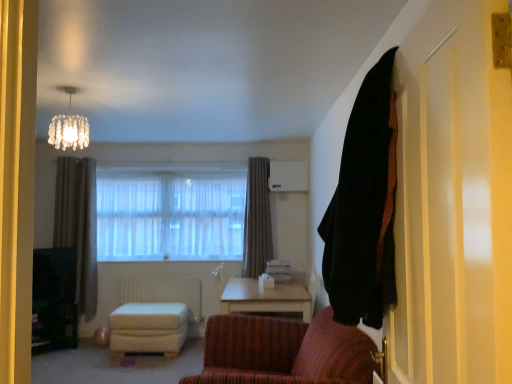
The height and width of the screenshot is (384, 512). In order to click on light wood table at center in this screenshot , I will do `click(268, 297)`.

The height and width of the screenshot is (384, 512). Describe the element at coordinates (69, 126) in the screenshot. I see `crystal glass chandelier at upper center` at that location.

How much space does black fabric curtain at upper right, the third curtain positioned from the back, occupy vertically?

black fabric curtain at upper right, the third curtain positioned from the back, is 38.89 inches tall.

This screenshot has width=512, height=384. What do you see at coordinates (257, 219) in the screenshot?
I see `brown fabric curtain at center, marked as the second curtain in a left-to-right arrangement` at bounding box center [257, 219].

I want to click on dark gray textured curtain at left, the third curtain when ordered from right to left, so (x=78, y=225).

What is the approximate width of dark gray textured curtain at left, marked as the second curtain in a back-to-front arrangement?

20.57 centimeters.

Find the location of a particular element. Image resolution: width=512 pixels, height=384 pixels. light wood table at center is located at coordinates (268, 297).

Is translucent fabric window at center far away from brown fabric curtain at center, acting as the 2th curtain starting from the right?

No, translucent fabric window at center is in close proximity to brown fabric curtain at center, acting as the 2th curtain starting from the right.

Looking at this image, considering the relative sizes of translucent fabric window at center and brown fabric curtain at center, marked as the second curtain in a left-to-right arrangement, in the image provided, is translucent fabric window at center smaller than brown fabric curtain at center, marked as the second curtain in a left-to-right arrangement,?

No.

Considering the sizes of translucent fabric window at center and brown fabric curtain at center, the 1th curtain viewed from the back, in the image, is translucent fabric window at center wider or thinner than brown fabric curtain at center, the 1th curtain viewed from the back,?

In the image, translucent fabric window at center appears to be more narrow than brown fabric curtain at center, the 1th curtain viewed from the back.

Can you confirm if brown fabric curtain at center, the 1th curtain viewed from the back, is smaller than crystal glass chandelier at upper center?

No.

From the image's perspective, which is below, brown fabric curtain at center, acting as the 2th curtain starting from the right, or crystal glass chandelier at upper center?

brown fabric curtain at center, acting as the 2th curtain starting from the right, from the image's perspective.

From the picture: Is brown fabric curtain at center, the 1th curtain viewed from the back, situated inside crystal glass chandelier at upper center or outside?

brown fabric curtain at center, the 1th curtain viewed from the back, lies outside crystal glass chandelier at upper center.

Consider the image. How different are the orientations of black fabric curtain at upper right, which ranks as the 3th curtain in left-to-right order, and dark gray textured curtain at left, marked as the second curtain in a back-to-front arrangement, in degrees?

87.5 degrees.

Which is closer to the camera, (373, 165) or (88, 174)?

Point (373, 165) is positioned closer to the camera compared to point (88, 174).

Visually, is black fabric curtain at upper right, the first curtain positioned from the right, positioned to the left or to the right of dark gray textured curtain at left, which is the first curtain from left to right?

Based on their positions, black fabric curtain at upper right, the first curtain positioned from the right, is located to the right of dark gray textured curtain at left, which is the first curtain from left to right.

Is black fabric curtain at upper right, the 1th curtain when ordered from front to back, looking in the opposite direction of dark gray textured curtain at left, the 2th curtain positioned from the front?

No, black fabric curtain at upper right, the 1th curtain when ordered from front to back, is not facing the opposite direction of dark gray textured curtain at left, the 2th curtain positioned from the front.

In the image, is dark gray textured curtain at left, the 2th curtain positioned from the front, positioned in front of or behind crystal glass chandelier at upper center?

dark gray textured curtain at left, the 2th curtain positioned from the front, is behind crystal glass chandelier at upper center.

Can you confirm if dark gray textured curtain at left, marked as the second curtain in a back-to-front arrangement, is wider than crystal glass chandelier at upper center?

No, dark gray textured curtain at left, marked as the second curtain in a back-to-front arrangement, is not wider than crystal glass chandelier at upper center.

Does dark gray textured curtain at left, marked as the second curtain in a back-to-front arrangement, appear on the right side of crystal glass chandelier at upper center?

No.

Is dark gray textured curtain at left, the 2th curtain positioned from the front, facing away from crystal glass chandelier at upper center?

No.

Consider the image. Considering the relative sizes of white fabric stool at center and black fabric curtain at upper right, which ranks as the 3th curtain in left-to-right order, in the image provided, is white fabric stool at center shorter than black fabric curtain at upper right, which ranks as the 3th curtain in left-to-right order,?

Correct, white fabric stool at center is not as tall as black fabric curtain at upper right, which ranks as the 3th curtain in left-to-right order.

Does white fabric stool at center turn towards black fabric curtain at upper right, the 1th curtain when ordered from front to back?

No, white fabric stool at center is not oriented towards black fabric curtain at upper right, the 1th curtain when ordered from front to back.

Which object is further away from the camera, white fabric stool at center or black fabric curtain at upper right, the third curtain positioned from the back?

white fabric stool at center is further away from the camera.

Can you see white fabric stool at center touching black fabric curtain at upper right, the first curtain positioned from the right?

Result: white fabric stool at center is not next to black fabric curtain at upper right, the first curtain positioned from the right, and they're not touching.

Looking at the image, does translucent fabric window at center seem bigger or smaller compared to crystal glass chandelier at upper center?

In the image, translucent fabric window at center appears to be larger than crystal glass chandelier at upper center.

Does point (128, 223) lie behind point (70, 137)?

Yes, point (128, 223) is behind point (70, 137).

Are translucent fabric window at center and crystal glass chandelier at upper center beside each other?

No, translucent fabric window at center is not touching crystal glass chandelier at upper center.

How many degrees apart are the facing directions of white matte radiator at lower center and crystal glass chandelier at upper center?

There is a 20.4-degree angle between the facing directions of white matte radiator at lower center and crystal glass chandelier at upper center.

From the image's perspective, which is below, white matte radiator at lower center or crystal glass chandelier at upper center?

white matte radiator at lower center is shown below in the image.

In the scene shown: From a real-world perspective, is white matte radiator at lower center physically below crystal glass chandelier at upper center?

Indeed, from a real-world perspective, white matte radiator at lower center is positioned beneath crystal glass chandelier at upper center.

Is white matte radiator at lower center looking in the opposite direction of crystal glass chandelier at upper center?

white matte radiator at lower center is not turned away from crystal glass chandelier at upper center.

From the image's perspective, starting from the translucent fabric window at center, which curtain is the 1st one below? Please provide its 2D coordinates.

[(257, 219)]

At what (x,y) coordinates should I click in order to perform the action: click on lamp that appears above the brown fabric curtain at center, the 1th curtain viewed from the back (from the image's perspective). Please return your answer as a coordinate pair (x, y). Looking at the image, I should click on (69, 126).

Estimate the real-world distances between objects in this image. Which object is further from crystal glass chandelier at upper center, white fabric stool at center or brown fabric curtain at center, the 3th curtain in the front-to-back sequence?

brown fabric curtain at center, the 3th curtain in the front-to-back sequence, is further to crystal glass chandelier at upper center.

Looking at the image, which one is located closer to brown fabric curtain at center, acting as the 2th curtain starting from the right, translucent fabric window at center or black fabric curtain at upper right, the third curtain positioned from the back?

The object closer to brown fabric curtain at center, acting as the 2th curtain starting from the right, is translucent fabric window at center.

Which object lies nearer to the anchor point white fabric stool at center, translucent fabric window at center or dark gray textured curtain at left, which is the first curtain from left to right?

translucent fabric window at center.

Considering their positions, is white fabric stool at center positioned closer to brown fabric curtain at center, the 1th curtain viewed from the back, than white matte radiator at lower center?

white matte radiator at lower center lies closer to brown fabric curtain at center, the 1th curtain viewed from the back, than the other object.

Estimate the real-world distances between objects in this image. Which object is closer to dark gray textured curtain at left, which is the first curtain from left to right, brown fabric curtain at center, the 3th curtain in the front-to-back sequence, or white matte radiator at lower center?

white matte radiator at lower center.

Estimate the real-world distances between objects in this image. Which object is closer to light wood table at center, brown fabric curtain at center, the 3th curtain in the front-to-back sequence, or white fabric stool at center?

brown fabric curtain at center, the 3th curtain in the front-to-back sequence, lies closer to light wood table at center than the other object.

Estimate the real-world distances between objects in this image. Which object is closer to white matte radiator at lower center, light wood table at center or crystal glass chandelier at upper center?

light wood table at center is positioned closer to the anchor white matte radiator at lower center.

Estimate the real-world distances between objects in this image. Which object is closer to translucent fabric window at center, white fabric stool at center or black fabric curtain at upper right, the third curtain positioned from the back?

Among the two, white fabric stool at center is located nearer to translucent fabric window at center.

This screenshot has width=512, height=384. Identify the location of lamp located between black fabric curtain at upper right, the first curtain positioned from the right, and translucent fabric window at center in the depth direction. (69, 126).

You are a GUI agent. You are given a task and a screenshot of the screen. Output one action in this format:
    pyautogui.click(x=<x>, y=<y>)
    Task: Click on the table between black fabric curtain at upper right, the first curtain positioned from the right, and brown fabric curtain at center, acting as the 2th curtain starting from the right, from front to back
    Image resolution: width=512 pixels, height=384 pixels.
    Given the screenshot: What is the action you would take?
    pyautogui.click(x=268, y=297)

I want to click on table located between black fabric curtain at upper right, the first curtain positioned from the right, and white fabric stool at center in the depth direction, so click(268, 297).

Locate an element on the screen. The width and height of the screenshot is (512, 384). stool located between black fabric curtain at upper right, the 1th curtain when ordered from front to back, and translucent fabric window at center in the depth direction is located at coordinates (148, 328).